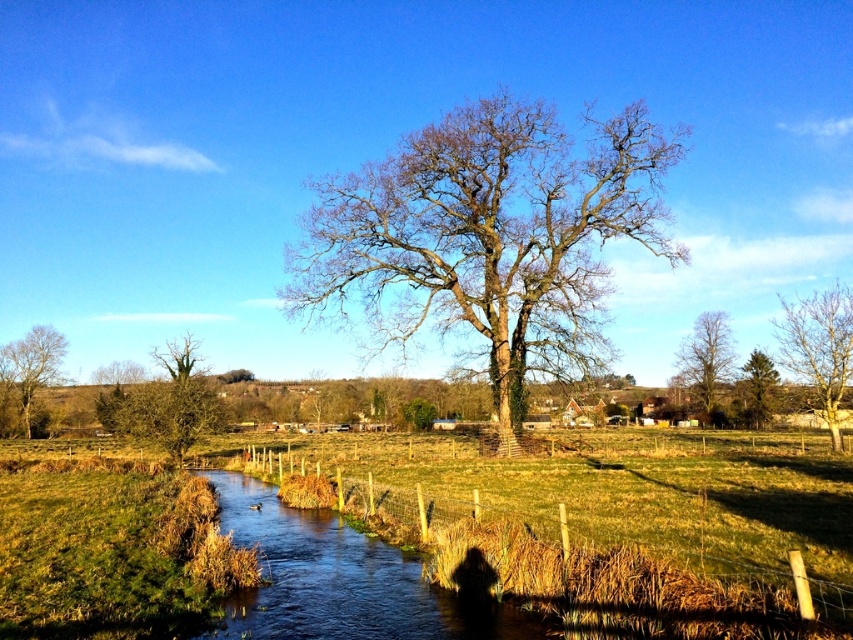
You are a hiker who wants to cross the stream but needs to stay within the area enclosed by the wooden post fence at center and the green textured pine tree at upper right. Can you fit between them without bending down?

The wooden post fence at center is larger in size than the green textured pine tree at upper right. Since the pine tree is smaller, the space between them might be sufficient, but the exact height isn

You are an artist sketching this landscape and want to ensure the tree positions are accurate. Which tree is positioned higher up in the image, the bare wood tree at center or the green textured pine tree at upper right?

The bare wood tree at center is positioned higher up in the image than the green textured pine tree at upper right.